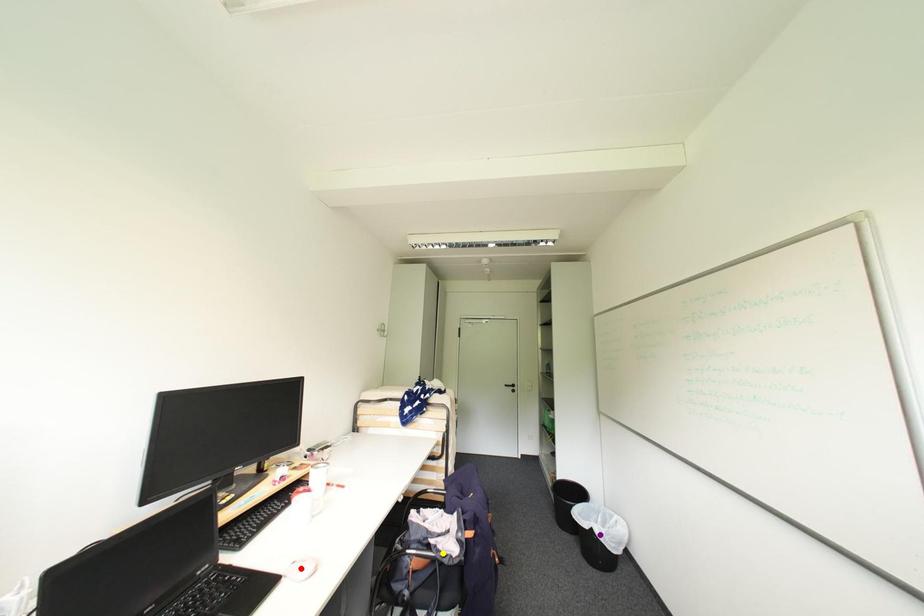
Order these from nearest to farthest:
- red point
- purple point
- yellow point

red point → yellow point → purple point